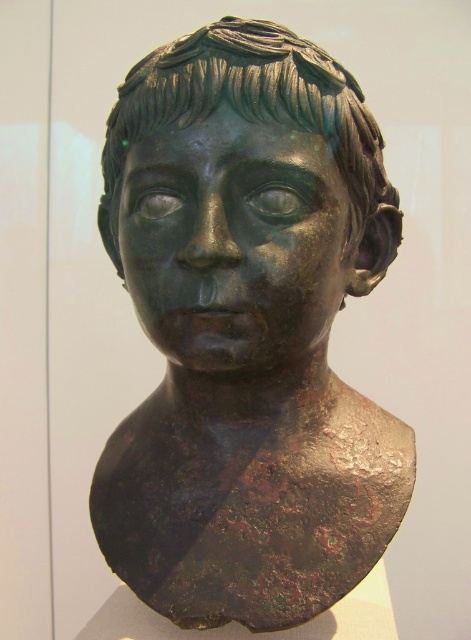
Question: Which point is closer to the camera?

Choices:
 (A) (203, 333)
 (B) (128, 241)

Answer: (A)

Question: Is bronze bust at center further to camera compared to shiny bronze face at center?

Choices:
 (A) no
 (B) yes

Answer: (A)

Question: From the image, what is the correct spatial relationship of bronze bust at center in relation to shiny bronze face at center?

Choices:
 (A) right
 (B) left

Answer: (A)

Question: Which of the following is the farthest from the observer?

Choices:
 (A) (211, 198)
 (B) (162, 605)

Answer: (B)

Question: Is bronze bust at center bigger than shiny bronze face at center?

Choices:
 (A) no
 (B) yes

Answer: (B)